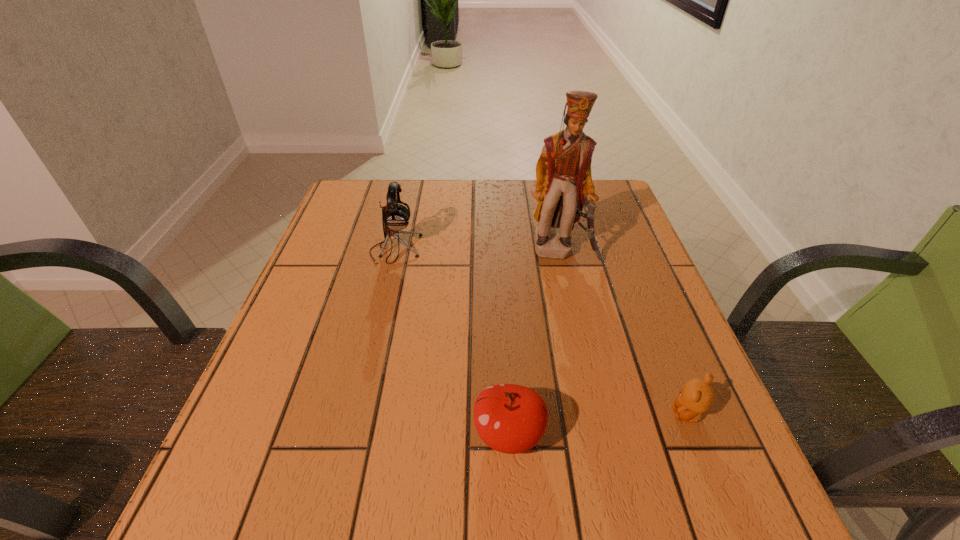
The image size is (960, 540). I want to click on vacant position at the far right corner of the desktop, so click(x=622, y=208).

In order to click on free spot between the third object from right to left and the earphone in this screenshot , I will do `click(452, 342)`.

This screenshot has height=540, width=960. I want to click on empty space that is in between the third object from left to right and the apple, so click(x=536, y=343).

Locate an element on the screen. vacant area that lies between the nutcracker and the earphone is located at coordinates (478, 250).

Identify the location of free space between the shortest object and the second shortest object. The width and height of the screenshot is (960, 540). (598, 424).

You are a GUI agent. You are given a task and a screenshot of the screen. Output one action in this format:
    pyautogui.click(x=<x>, y=<y>)
    Task: Click on the empty space between the apple and the shortest object
    This screenshot has width=960, height=540.
    Given the screenshot: What is the action you would take?
    pyautogui.click(x=598, y=424)

Locate an element on the screen. This screenshot has width=960, height=540. vacant area that lies between the earphone and the third tallest object is located at coordinates (452, 342).

At what (x,y) coordinates should I click in order to perform the action: click on empty location between the second shortest object and the teddy bear. Please return your answer as a coordinate pair (x, y). Image resolution: width=960 pixels, height=540 pixels. Looking at the image, I should click on (598, 424).

This screenshot has width=960, height=540. Identify the location of empty space between the tallest object and the teddy bear. (625, 333).

At what (x,y) coordinates should I click in order to perform the action: click on free space between the apple and the leftmost object. Please return your answer as a coordinate pair (x, y). This screenshot has height=540, width=960. Looking at the image, I should click on [x=452, y=342].